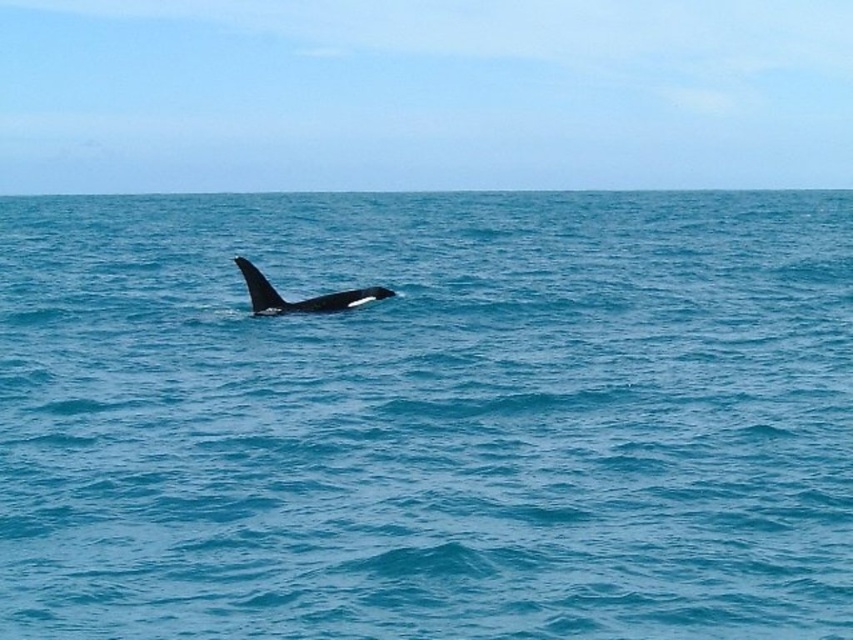
Question: Does blue water at center come behind black smooth whale at center?

Choices:
 (A) no
 (B) yes

Answer: (A)

Question: Which of the following is the closest to the observer?

Choices:
 (A) (247, 284)
 (B) (323, 570)

Answer: (B)

Question: Which point appears farthest from the camera in this image?

Choices:
 (A) (354, 298)
 (B) (120, 444)

Answer: (A)

Question: Considering the relative positions of blue water at center and black smooth whale at center in the image provided, where is blue water at center located with respect to black smooth whale at center?

Choices:
 (A) below
 (B) above

Answer: (B)

Question: Is blue water at center below black smooth whale at center?

Choices:
 (A) no
 (B) yes

Answer: (A)